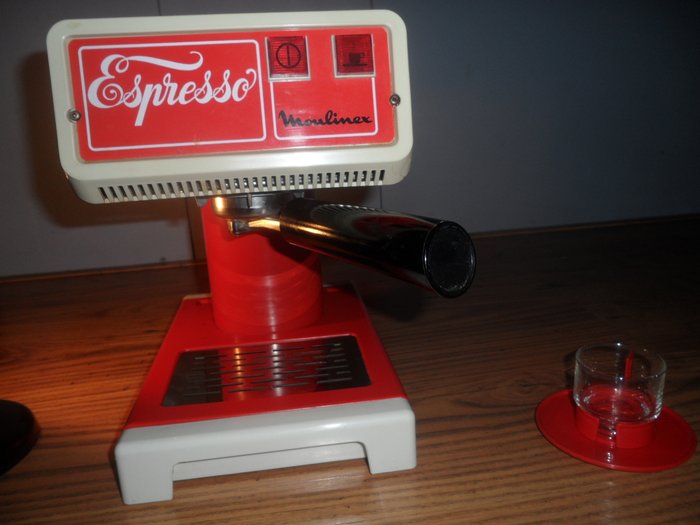
The height and width of the screenshot is (525, 700). I want to click on espresso glass, so click(x=624, y=404).